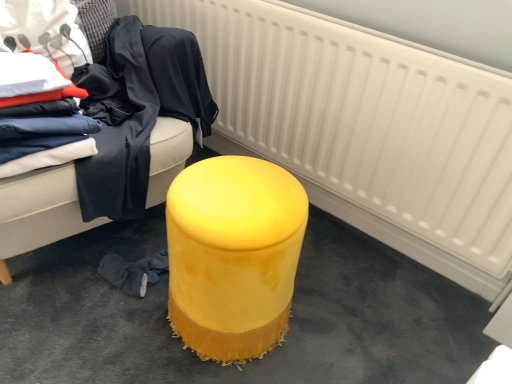
Question: Can we say velvet yellow ottoman at center lies outside white textured radiator at center?

Choices:
 (A) yes
 (B) no

Answer: (A)

Question: Does velvet yellow ottoman at center appear on the left side of white textured radiator at center?

Choices:
 (A) yes
 (B) no

Answer: (A)

Question: Is white textured radiator at center inside velvet yellow ottoman at center?

Choices:
 (A) yes
 (B) no

Answer: (B)

Question: Considering the relative sizes of velvet yellow ottoman at center and white textured radiator at center in the image provided, is velvet yellow ottoman at center bigger than white textured radiator at center?

Choices:
 (A) no
 (B) yes

Answer: (B)

Question: Is velvet yellow ottoman at center positioned far away from white textured radiator at center?

Choices:
 (A) no
 (B) yes

Answer: (A)

Question: From a real-world perspective, is velvet yellow ottoman at center physically above white textured radiator at center?

Choices:
 (A) no
 (B) yes

Answer: (B)

Question: Does white textured radiator at center appear on the right side of matte white fabric at upper left, the first clothing positioned from the left?

Choices:
 (A) no
 (B) yes

Answer: (B)

Question: From the image's perspective, is white textured radiator at center on matte white fabric at upper left, placed as the fourth clothing when sorted from right to left?

Choices:
 (A) yes
 (B) no

Answer: (B)

Question: From a real-world perspective, is white textured radiator at center positioned under matte white fabric at upper left, the first clothing positioned from the left, based on gravity?

Choices:
 (A) yes
 (B) no

Answer: (A)

Question: Can you confirm if white textured radiator at center is shorter than matte white fabric at upper left, the first clothing positioned from the left?

Choices:
 (A) no
 (B) yes

Answer: (A)

Question: Is white textured radiator at center next to matte white fabric at upper left, placed as the fourth clothing when sorted from right to left?

Choices:
 (A) yes
 (B) no

Answer: (B)

Question: Is the position of white textured radiator at center more distant than that of matte white fabric at upper left, placed as the fourth clothing when sorted from right to left?

Choices:
 (A) yes
 (B) no

Answer: (B)

Question: Is velvet yellow stool at center bigger than velvet yellow ottoman at center?

Choices:
 (A) no
 (B) yes

Answer: (A)